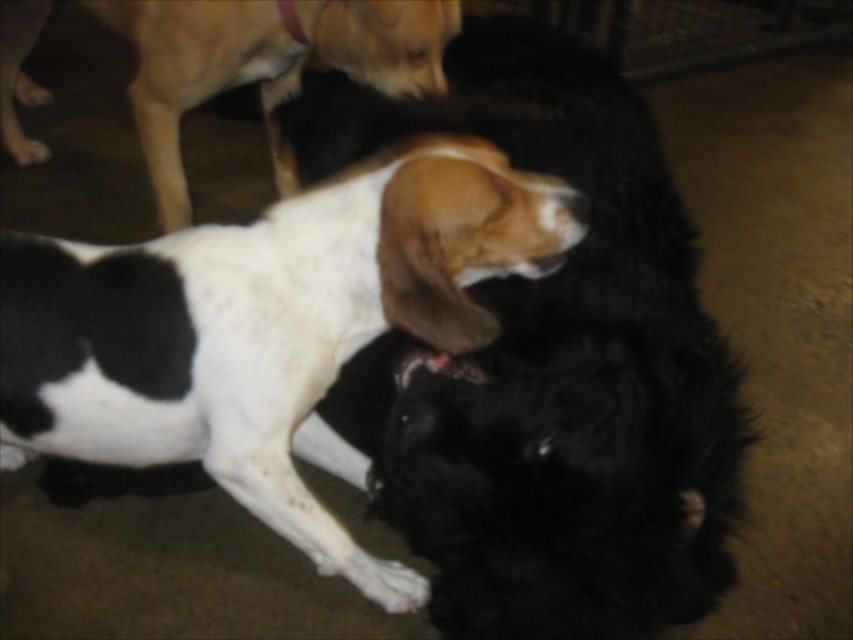
Question: Is white and black fur dog at center smaller than white and brown fur dog at center?

Choices:
 (A) no
 (B) yes

Answer: (B)

Question: Is black fluffy dog at center smaller than white and brown fur dog at center?

Choices:
 (A) yes
 (B) no

Answer: (B)

Question: Which is nearer to the white and brown fur dog at center?

Choices:
 (A) black fluffy dog at center
 (B) white and black fur dog at center

Answer: (A)

Question: Which point is farther from the camera taking this photo?

Choices:
 (A) (724, 426)
 (B) (93, 1)
 (C) (25, 381)

Answer: (B)

Question: Which of these objects is positioned farthest from the white and brown fur dog at center?

Choices:
 (A) black fluffy dog at center
 (B) white and black fur dog at center

Answer: (B)

Question: Is black fluffy dog at center further to camera compared to white and brown fur dog at center?

Choices:
 (A) yes
 (B) no

Answer: (B)